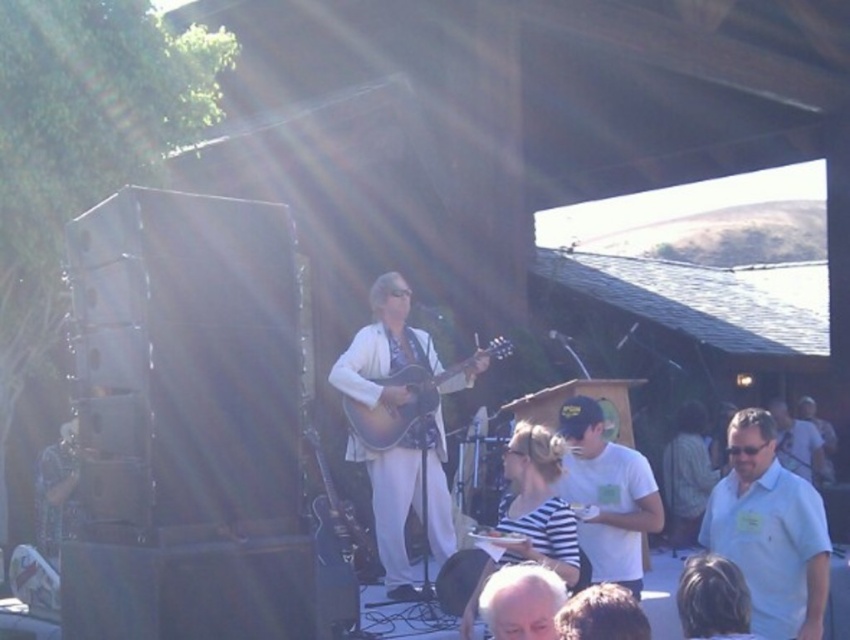
Can you confirm if white t-shirt at center is positioned to the left of glossy black guitar at center?

Incorrect, white t-shirt at center is not on the left side of glossy black guitar at center.

Between white t-shirt at center and glossy black guitar at center, which one has more height?

white t-shirt at center is taller.

Does point (639, 474) come in front of point (324, 477)?

That is True.

At what (x,y) coordinates should I click in order to perform the action: click on white t-shirt at center. Please return your answer as a coordinate pair (x, y). The width and height of the screenshot is (850, 640). Looking at the image, I should click on (x=605, y=493).

Which is behind, point (358, 436) or point (527, 616)?

Positioned behind is point (358, 436).

Consider the image. Is matte brown acoustic guitar at center taller than white matte hair at lower center?

Yes.

Is point (386, 378) farther from camera compared to point (536, 605)?

Yes, it is.

The image size is (850, 640). What are the coordinates of `matte brown acoustic guitar at center` in the screenshot? It's located at (409, 400).

Image resolution: width=850 pixels, height=640 pixels. What do you see at coordinates (605, 493) in the screenshot? I see `white t-shirt at center` at bounding box center [605, 493].

Identify the location of white t-shirt at center. The height and width of the screenshot is (640, 850). (605, 493).